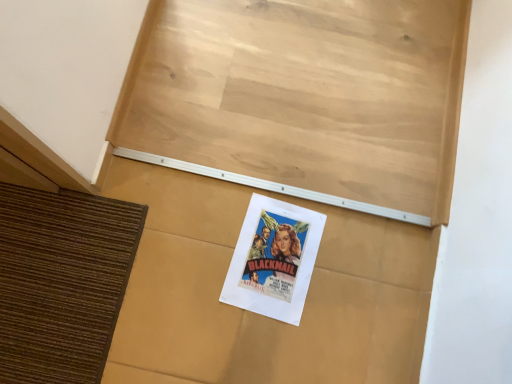
Locate an element on the screen. The image size is (512, 384). vacant region to the right of matte paper poster at center is located at coordinates (356, 294).